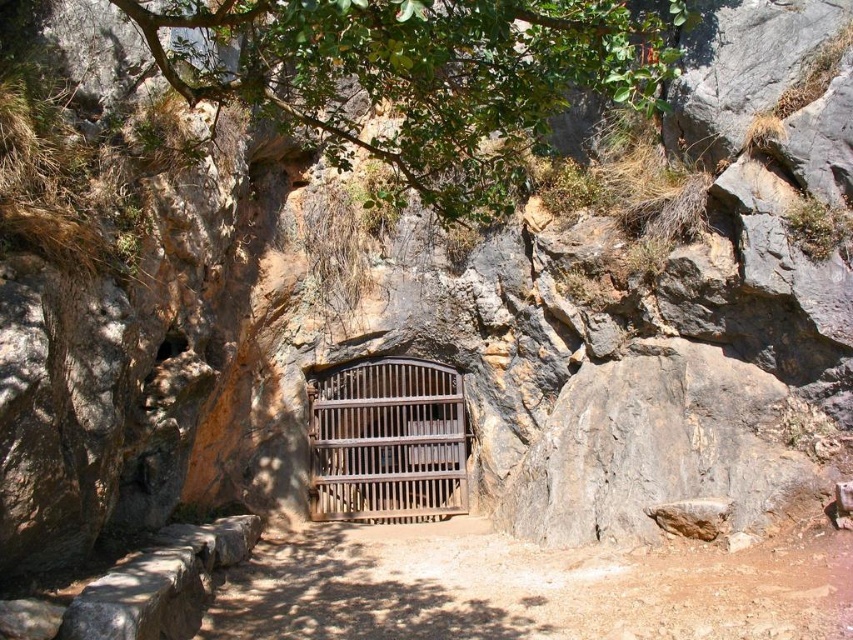
You are an explorer standing in front of the cave entrance. You notice the green leafy tree at upper center and the brown wooden gate at center. Which object appears shorter in the scene?

The green leafy tree at upper center appears shorter than the brown wooden gate at center.

You are standing at the entrance of the cave and notice a point marked at coordinates (421, 76). According to the scene description, what object is located at that point?

The point at coordinates (421, 76) marks the location of the green leafy tree at upper center.

You are an explorer approaching the cave entrance. You notice the green leafy tree at upper center and the brown wooden gate at center. Which object would you see first as you move closer to the entrance?

The green leafy tree at upper center would be seen first as you approach because it is closer to the viewer than the brown wooden gate at center.